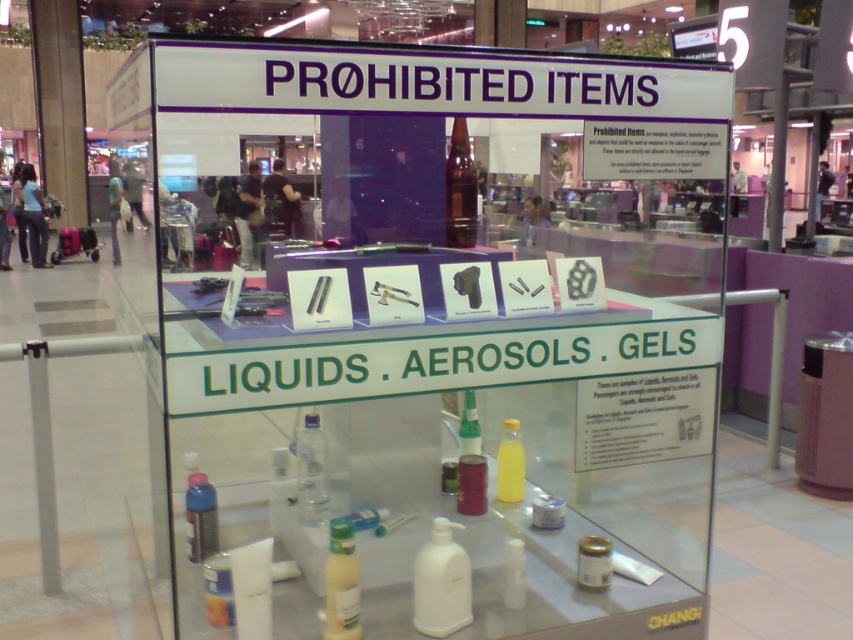
Question: Which point is closer to the camera taking this photo?

Choices:
 (A) (300, 456)
 (B) (190, 515)
 (C) (518, 426)

Answer: (B)

Question: Among these objects, which one is farthest from the camera?

Choices:
 (A) green glass bottle at center
 (B) translucent plastic bottle at center
 (C) transparent glass bottle at center
 (D) yellow translucent bottle at center

Answer: (D)

Question: Among these objects, which one is farthest from the camera?

Choices:
 (A) translucent plastic bottle at lower left
 (B) translucent plastic bottle at center

Answer: (A)

Question: Does transparent glass bottle at center have a larger size compared to yellow translucent bottle at center?

Choices:
 (A) yes
 (B) no

Answer: (A)

Question: Can you confirm if translucent plastic bottle at center is positioned to the left of transparent glass bottle at center?

Choices:
 (A) yes
 (B) no

Answer: (A)

Question: Does translucent plastic bottle at center have a smaller size compared to translucent plastic bottle at lower left?

Choices:
 (A) no
 (B) yes

Answer: (B)